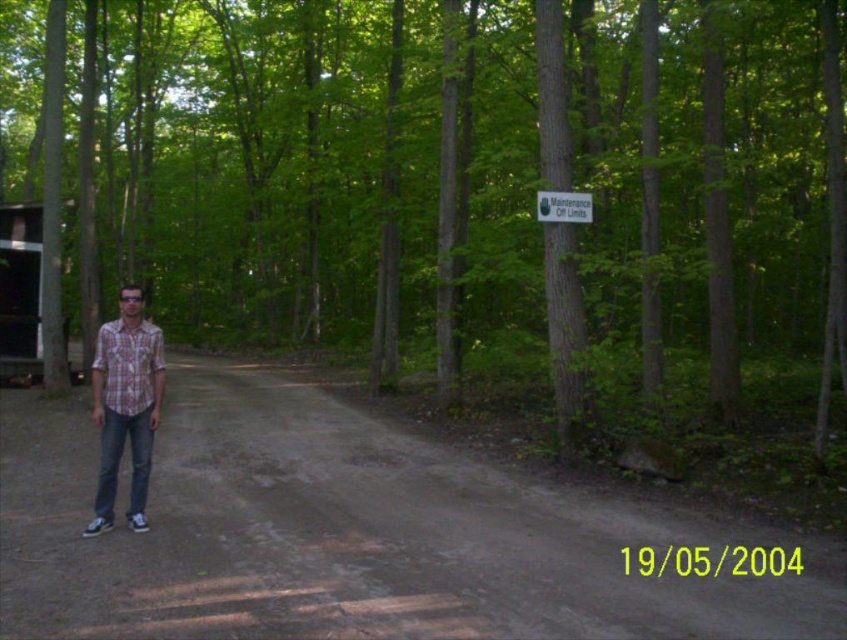
Is plaid shirt at center taller than plaid cotton shirt at center?

Yes, plaid shirt at center is taller than plaid cotton shirt at center.

Does plaid shirt at center have a greater width compared to plaid cotton shirt at center?

Indeed, plaid shirt at center has a greater width compared to plaid cotton shirt at center.

Is point (102, 380) farther from camera compared to point (98, 368)?

That is True.

Locate an element on the screen. The height and width of the screenshot is (640, 847). plaid shirt at center is located at coordinates (125, 404).

Is brown dirt track at center smaller than white plastic sign at upper center?

No, brown dirt track at center is not smaller than white plastic sign at upper center.

Is brown dirt track at center to the left of white plastic sign at upper center from the viewer's perspective?

Yes, brown dirt track at center is to the left of white plastic sign at upper center.

You are a GUI agent. You are given a task and a screenshot of the screen. Output one action in this format:
    pyautogui.click(x=<x>, y=<y>)
    Task: Click on the brown dirt track at center
    This screenshot has width=847, height=640.
    Given the screenshot: What is the action you would take?
    pyautogui.click(x=346, y=532)

Does brown textured tree at center have a greater width compared to white plastic sign at upper center?

Yes.

Between point (778, 220) and point (547, 196), which one is positioned behind?

Point (778, 220)

Measure the distance between point (353, 200) and camera.

They are 28.37 meters apart.

Identify the location of brown textured tree at center. (447, 182).